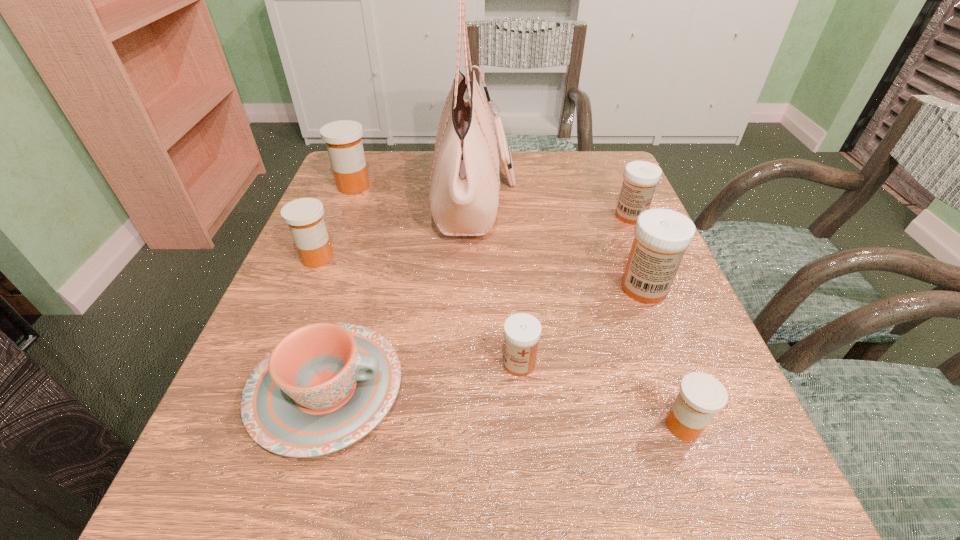
Where is `the leftmost white medicine`? The image size is (960, 540). the leftmost white medicine is located at coordinates 522,331.

Image resolution: width=960 pixels, height=540 pixels. Identify the location of the smallest orange medicine. (701, 395).

Identify the location of the nearest orange medicine. The image size is (960, 540). (701, 395).

This screenshot has height=540, width=960. What are the coordinates of `pink chinaware` in the screenshot? It's located at (324, 386).

The image size is (960, 540). I want to click on vacant region located 0.120m on the side of the handbag with the attached pouch, so click(566, 200).

Where is `vacant position located 0.270m on the label of the biggest orange medicine`? The width and height of the screenshot is (960, 540). vacant position located 0.270m on the label of the biggest orange medicine is located at coordinates (481, 186).

Find the location of `vacant area situated on the front of the fourth nearest object`. vacant area situated on the front of the fourth nearest object is located at coordinates (683, 386).

Image resolution: width=960 pixels, height=540 pixels. What are the coordinates of `free region located on the label of the second biggest orange medicine` in the screenshot? It's located at (361, 258).

Where is `free space located 0.320m on the left of the farthest white medicine`? The width and height of the screenshot is (960, 540). free space located 0.320m on the left of the farthest white medicine is located at coordinates (474, 216).

Find the location of a particular element. free location located on the left of the smallest white medicine is located at coordinates (327, 363).